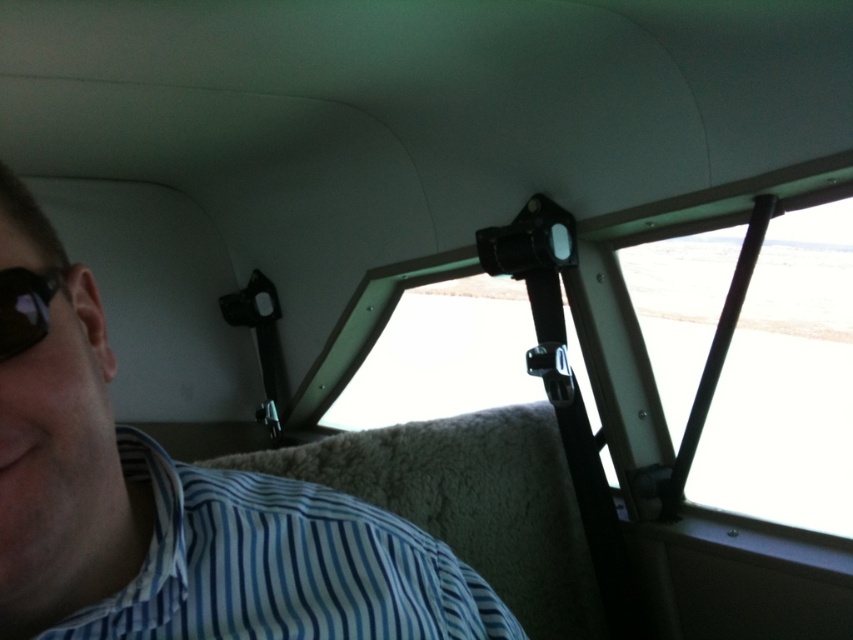
Which is above, transparent plastic window at upper center or black matte goggles at left?

black matte goggles at left is higher up.

Locate an element on the screen. This screenshot has height=640, width=853. transparent plastic window at upper center is located at coordinates (757, 362).

How distant is blue striped fabric shirt at lower left from black matte goggles at left?

The distance of blue striped fabric shirt at lower left from black matte goggles at left is 8.55 inches.

Does blue striped fabric shirt at lower left appear on the left side of black matte goggles at left?

In fact, blue striped fabric shirt at lower left is to the right of black matte goggles at left.

Between point (74, 628) and point (54, 276), which one is positioned behind?

The point (54, 276) is more distant.

Find the location of a particular element. blue striped fabric shirt at lower left is located at coordinates (282, 564).

The image size is (853, 640). I want to click on blue striped shirt at upper left, so click(183, 513).

Measure the distance from blue striped shirt at upper left to transparent plastic window at upper center.

blue striped shirt at upper left and transparent plastic window at upper center are 5.97 feet apart.

Identify the location of blue striped shirt at upper left. click(183, 513).

Identify the location of blue striped shirt at upper left. The image size is (853, 640). (183, 513).